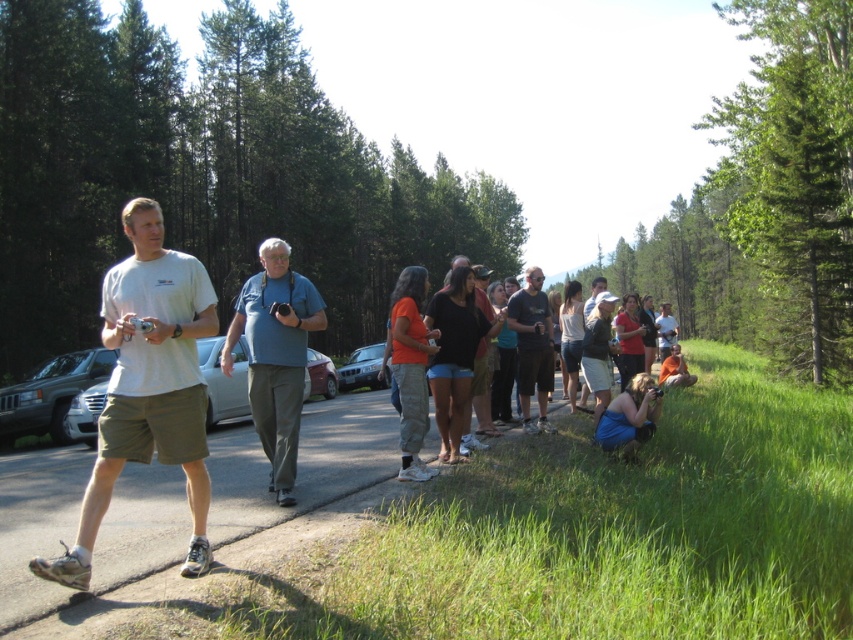
You are standing at the point labeled point (537, 291) and want to reach the other side of the road. The road is 33.78 feet wide. If your stride length is 2.5 feet, how many steps will you need to take to cross the road safely?

The road is 33.78 feet wide, and each step covers 2.5 feet. Dividing 33.78 by 2.5 gives approximately 13.51 steps. Since you can only take whole steps, you would need to take 14 steps to safely cross the road.

You are standing at the edge of the forest path and see the point marked at coordinates point [300,461]. What type of surface is located at that point?

The point [300,461] is on concrete pavement at center.